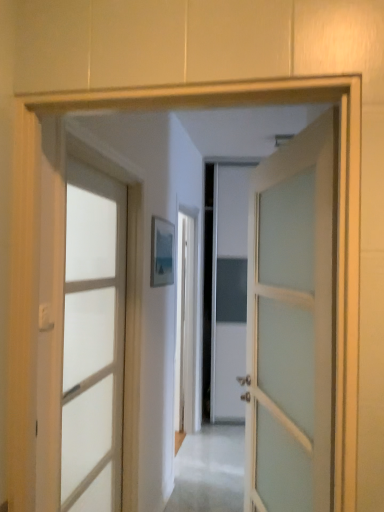
Question: Visually, is clear glass door at left, placed as the second door when sorted from right to left, positioned to the left or to the right of satin white door at center, the 1th door when ordered from right to left?

Choices:
 (A) left
 (B) right

Answer: (A)

Question: From a real-world perspective, relative to satin white door at center, which appears as the second door when viewed from the left, is clear glass door at left, placed as the second door when sorted from right to left, vertically above or below?

Choices:
 (A) below
 (B) above

Answer: (A)

Question: Is clear glass door at left, placed as the second door when sorted from right to left, spatially inside satin white door at center, which appears as the second door when viewed from the left, or outside of it?

Choices:
 (A) inside
 (B) outside

Answer: (B)

Question: From the image's perspective, relative to clear glass door at left, placed as the second door when sorted from right to left, is satin white door at center, the 1th door when ordered from right to left, above or below?

Choices:
 (A) below
 (B) above

Answer: (B)

Question: From a real-world perspective, is satin white door at center, which appears as the second door when viewed from the left, positioned above or below clear glass door at left, the 1th door positioned from the left?

Choices:
 (A) above
 (B) below

Answer: (A)

Question: In terms of width, does satin white door at center, the 1th door when ordered from right to left, look wider or thinner when compared to clear glass door at left, placed as the second door when sorted from right to left?

Choices:
 (A) wide
 (B) thin

Answer: (A)

Question: Based on their sizes in the image, would you say satin white door at center, the 1th door when ordered from right to left, is bigger or smaller than clear glass door at left, placed as the second door when sorted from right to left?

Choices:
 (A) big
 (B) small

Answer: (A)